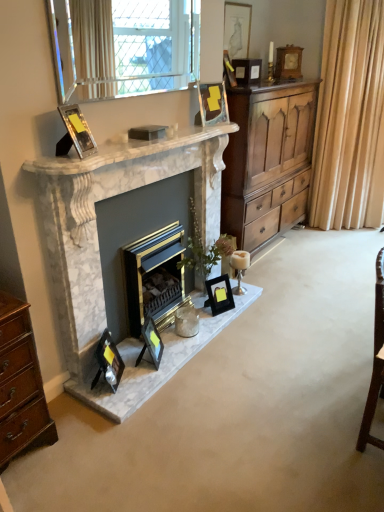
What do you see at coordinates (349, 119) in the screenshot?
I see `beige fabric curtain at right` at bounding box center [349, 119].

Describe the element at coordinates (126, 151) in the screenshot. This screenshot has width=384, height=512. I see `white marble fireplace at upper center` at that location.

This screenshot has width=384, height=512. Find the location of `white marble fireplace at center, acting as the 1th fireplace starting from the front`. white marble fireplace at center, acting as the 1th fireplace starting from the front is located at coordinates pos(96,220).

Where is `matte black picture frame at upper center, which is the second picture frame from back to front`? Image resolution: width=384 pixels, height=512 pixels. matte black picture frame at upper center, which is the second picture frame from back to front is located at coordinates (237, 29).

The height and width of the screenshot is (512, 384). What do you see at coordinates (108, 361) in the screenshot?
I see `matte black picture frame at lower left, which is counted as the second picture frame, starting from the front` at bounding box center [108, 361].

What do you see at coordinates (204, 251) in the screenshot?
I see `green leafy plant at center` at bounding box center [204, 251].

At what (x,y) coordinates should I click in order to perform the action: click on matte black picture frame at lower center, the second picture frame from the bottom. Please return your answer as a coordinate pair (x, y). Looking at the image, I should click on [x=151, y=342].

What do you see at coordinates (151, 342) in the screenshot?
I see `matte black picture frame at lower center, the second picture frame from the bottom` at bounding box center [151, 342].

Identify the location of beige fabric curtain at right. (349, 119).

Considering the relative positions of gold metallic fireplace at center, marked as the 1th fireplace in a back-to-front arrangement, and green leafy plant at center in the image provided, is gold metallic fireplace at center, marked as the 1th fireplace in a back-to-front arrangement, to the left or to the right of green leafy plant at center?

From the image, it's evident that gold metallic fireplace at center, marked as the 1th fireplace in a back-to-front arrangement, is to the left of green leafy plant at center.

From the picture: From a real-world perspective, who is located higher, gold metallic fireplace at center, marked as the 2th fireplace in a front-to-back arrangement, or green leafy plant at center?

green leafy plant at center is physically above.

Considering their positions, is gold metallic fireplace at center, marked as the 2th fireplace in a front-to-back arrangement, located in front of or behind green leafy plant at center?

gold metallic fireplace at center, marked as the 2th fireplace in a front-to-back arrangement, is in front of green leafy plant at center.

Is gold metallic fireplace at center, marked as the 1th fireplace in a back-to-front arrangement, not near green leafy plant at center?

No, there isn't a large distance between gold metallic fireplace at center, marked as the 1th fireplace in a back-to-front arrangement, and green leafy plant at center.

Are white glass candle holder at lower center and matte black picture frame at lower center, the 3th picture frame positioned from the left, making contact?

white glass candle holder at lower center and matte black picture frame at lower center, the 3th picture frame positioned from the left, are not in contact.

From a real-world perspective, is white glass candle holder at lower center above or below matte black picture frame at lower center, the 3th picture frame positioned from the left?

Clearly, from a real-world perspective, white glass candle holder at lower center is above matte black picture frame at lower center, the 3th picture frame positioned from the left.

From the picture: Is white glass candle holder at lower center in front of matte black picture frame at lower center, the fifth picture frame in the right-to-left sequence?

No.

In the image, is wooden cupboard at right positioned in front of or behind white marble fireplace at upper center?

Visually, wooden cupboard at right is located behind white marble fireplace at upper center.

Does wooden cupboard at right have a greater height compared to white marble fireplace at upper center?

Correct, wooden cupboard at right is much taller as white marble fireplace at upper center.

Can you tell me how much wooden cupboard at right and white marble fireplace at upper center differ in facing direction?

The facing directions of wooden cupboard at right and white marble fireplace at upper center are 0.314 degrees apart.

From a real-world perspective, is wooden cupboard at right positioned above or below white marble fireplace at upper center?

Clearly, from a real-world perspective, wooden cupboard at right is below white marble fireplace at upper center.

Is matte black picture frame at lower center, the fifth picture frame in the right-to-left sequence, positioned far away from clear glass window at upper center?

Absolutely, matte black picture frame at lower center, the fifth picture frame in the right-to-left sequence, is distant from clear glass window at upper center.

From a real-world perspective, is matte black picture frame at lower center, which ranks as the 3th picture frame in front-to-back order, located higher than clear glass window at upper center?

Incorrect, from a real-world perspective, matte black picture frame at lower center, which ranks as the 3th picture frame in front-to-back order, is lower than clear glass window at upper center.

Is clear glass window at upper center surrounded by matte black picture frame at lower center, the 6th picture frame from the top?

Actually, clear glass window at upper center is outside matte black picture frame at lower center, the 6th picture frame from the top.

Is matte black picture frame at lower center, the 3th picture frame positioned from the left, positioned before clear glass window at upper center?

No, matte black picture frame at lower center, the 3th picture frame positioned from the left, is further to the viewer.

Where is `the 4th picture frame counting from the left side of the white glass candle holder at lower center`? This screenshot has width=384, height=512. the 4th picture frame counting from the left side of the white glass candle holder at lower center is located at coordinates (108, 361).

Between matte black picture frame at lower left, which is the 2th picture frame from left to right, and white glass candle holder at lower center, which one appears on the right side from the viewer's perspective?

From the viewer's perspective, white glass candle holder at lower center appears more on the right side.

Is white glass candle holder at lower center surrounded by matte black picture frame at lower left, the sixth picture frame from the right?

No, white glass candle holder at lower center is not inside matte black picture frame at lower left, the sixth picture frame from the right.

From the image's perspective, relative to white glass candle holder at lower center, is matte black picture frame at lower left, which is the sixth picture frame from back to front, above or below?

A: matte black picture frame at lower left, which is the sixth picture frame from back to front, is situated lower than white glass candle holder at lower center in the image.

What's the angular difference between wooden cupboard at right and black glossy picture frame at lower center, which is the fifth picture frame from top to bottom,'s facing directions?

20.9 degrees.

From their relative heights in the image, would you say wooden cupboard at right is taller or shorter than black glossy picture frame at lower center, which is the fifth picture frame from top to bottom?

wooden cupboard at right is taller than black glossy picture frame at lower center, which is the fifth picture frame from top to bottom.

Is wooden cupboard at right wider than black glossy picture frame at lower center, which is counted as the 3th picture frame, starting from the right?

Correct, the width of wooden cupboard at right exceeds that of black glossy picture frame at lower center, which is counted as the 3th picture frame, starting from the right.

From the picture: From the image's perspective, which one is positioned lower, wooden cupboard at right or black glossy picture frame at lower center, acting as the third picture frame starting from the bottom?

black glossy picture frame at lower center, acting as the third picture frame starting from the bottom, appears lower in the image.

From a real-world perspective, is matte black picture frame at upper center, marked as the second picture frame in a right-to-left arrangement, below beige fabric curtain at right?

Actually, matte black picture frame at upper center, marked as the second picture frame in a right-to-left arrangement, is physically above beige fabric curtain at right in the real world.

Consider the image. Which object is further away from the camera taking this photo, matte black picture frame at upper center, the first picture frame when ordered from top to bottom, or beige fabric curtain at right?

beige fabric curtain at right is more distant.

The height and width of the screenshot is (512, 384). Find the location of `the 1st picture frame in front when counting from the beige fabric curtain at right`. the 1st picture frame in front when counting from the beige fabric curtain at right is located at coordinates (237, 29).

Does matte black picture frame at upper center, which is the sixth picture frame from front to back, contain beige fabric curtain at right?

No, beige fabric curtain at right is not a part of matte black picture frame at upper center, which is the sixth picture frame from front to back.

Which fireplace is the 1st one when counting from the front of the green leafy plant at center? Please provide its 2D coordinates.

[(154, 277)]

At what (x,y) coordinates should I click in order to perform the action: click on candle holder above the matte black picture frame at lower center, the fifth picture frame in the right-to-left sequence (from the image's perspective). Please return your answer as a coordinate pair (x, y). Looking at the image, I should click on (239, 268).

Looking at the image, which one is located further to white marble fireplace at center, marked as the 2th fireplace in a back-to-front arrangement, matte black picture frame at lower center, the second picture frame from the bottom, or white marble fireplace at upper center?

matte black picture frame at lower center, the second picture frame from the bottom.

When comparing their distances from white marble fireplace at center, marked as the 2th fireplace in a back-to-front arrangement, does metallic reflective photo frame at upper left, which is counted as the first picture frame, starting from the front, or white marble fireplace at upper center seem closer?

The object closer to white marble fireplace at center, marked as the 2th fireplace in a back-to-front arrangement, is white marble fireplace at upper center.

From the image, which object appears to be nearer to white marble fireplace at center, acting as the 1th fireplace starting from the front, wooden cupboard at right or white marble fireplace at upper center?

white marble fireplace at upper center.

From the image, which object appears to be farther from white marble fireplace at center, acting as the 1th fireplace starting from the front, green leafy plant at center or beige fabric curtain at right?

The object further to white marble fireplace at center, acting as the 1th fireplace starting from the front, is beige fabric curtain at right.

Estimate the real-world distances between objects in this image. Which object is closer to matte black picture frame at lower center, the 3th picture frame positioned from the left, beige fabric curtain at right or wooden picture frame at upper right, placed as the first picture frame when sorted from right to left?

wooden picture frame at upper right, placed as the first picture frame when sorted from right to left, is positioned closer to the anchor matte black picture frame at lower center, the 3th picture frame positioned from the left.

From the image, which object appears to be nearer to white marble fireplace at upper center, metallic reflective photo frame at upper left, which is counted as the first picture frame, starting from the front, or gold metallic fireplace at center, marked as the 1th fireplace in a back-to-front arrangement?

metallic reflective photo frame at upper left, which is counted as the first picture frame, starting from the front, is positioned closer to the anchor white marble fireplace at upper center.

Considering their positions, is white glass candle holder at lower center positioned closer to metallic reflective photo frame at upper left, which appears as the 7th picture frame when viewed from the back, than green leafy plant at center?

Among the two, green leafy plant at center is located nearer to metallic reflective photo frame at upper left, which appears as the 7th picture frame when viewed from the back.

Based on their spatial positions, is green leafy plant at center or matte black picture frame at lower left, the sixth picture frame from the right, further from wooden picture frame at upper right, placed as the first picture frame when sorted from right to left?

Among the two, matte black picture frame at lower left, the sixth picture frame from the right, is located further to wooden picture frame at upper right, placed as the first picture frame when sorted from right to left.

Find the location of `plant located between gold metallic fireplace at center, marked as the 2th fireplace in a front-to-back arrangement, and beige fabric curtain at right in the left-right direction`. plant located between gold metallic fireplace at center, marked as the 2th fireplace in a front-to-back arrangement, and beige fabric curtain at right in the left-right direction is located at coordinates (204, 251).

At what (x,y) coordinates should I click in order to perform the action: click on candle holder between matte black picture frame at upper center, which is the third picture frame in top-to-bottom order, and matte black picture frame at lower center, the 5th picture frame positioned from the back, in the vertical direction. Please return your answer as a coordinate pair (x, y). Looking at the image, I should click on (239, 268).

Where is `picture frame between matte black picture frame at upper center, which is the third picture frame in top-to-bottom order, and gold metallic fireplace at center, marked as the 1th fireplace in a back-to-front arrangement, in the up-down direction`? picture frame between matte black picture frame at upper center, which is the third picture frame in top-to-bottom order, and gold metallic fireplace at center, marked as the 1th fireplace in a back-to-front arrangement, in the up-down direction is located at coordinates (75, 132).

Find the location of a particular element. The image size is (384, 512). curtain between white marble fireplace at center, marked as the 2th fireplace in a back-to-front arrangement, and wooden picture frame at upper right, acting as the seventh picture frame starting from the left, in the front-back direction is located at coordinates point(349,119).